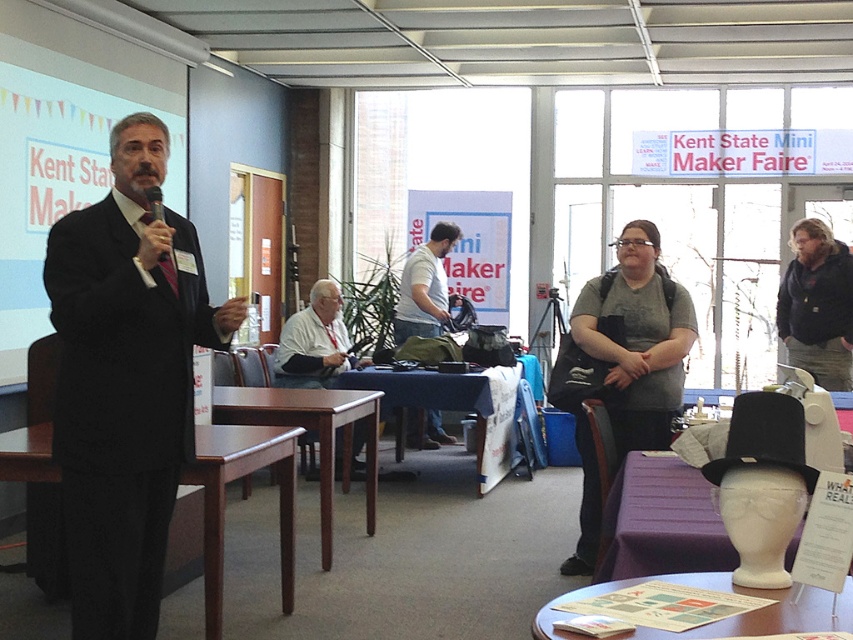
Question: Which is nearer to the mahogany wood table at center?

Choices:
 (A) white glossy table at lower center
 (B) gray fabric purse at center
 (C) white fabric shirt at center
 (D) black matte suit at left

Answer: (C)

Question: Which point is farther from the camera taking this photo?

Choices:
 (A) (456, 230)
 (B) (200, 440)

Answer: (A)

Question: Does gray fabric purse at center appear on the right side of purple fabric table at lower right?

Choices:
 (A) no
 (B) yes

Answer: (B)

Question: Is purple fabric table at lower right bigger than white fabric shirt at center?

Choices:
 (A) yes
 (B) no

Answer: (B)

Question: Which point appears farthest from the camera in this image?

Choices:
 (A) (428, 378)
 (B) (170, 92)

Answer: (B)

Question: Is black matte suit at left bigger than gray fabric purse at center?

Choices:
 (A) yes
 (B) no

Answer: (B)